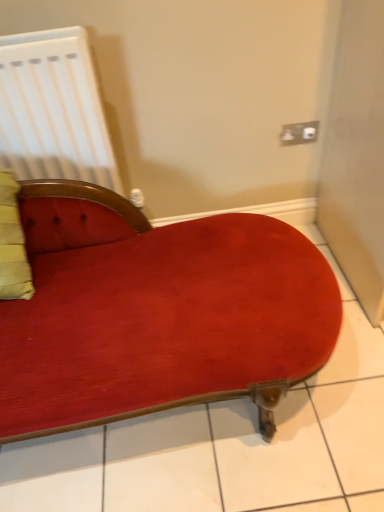
Describe the element at coordinates (53, 110) in the screenshot. I see `white textured radiator at upper left` at that location.

The image size is (384, 512). Identify the location of white textured radiator at upper left. (53, 110).

Where is `white textured radiator at upper left`? This screenshot has height=512, width=384. white textured radiator at upper left is located at coordinates (x=53, y=110).